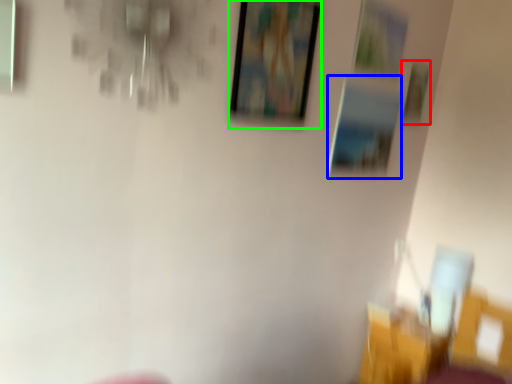
Question: Considering the real-world distances, which object is closest to picture frame (highlighted by a red box)? picture frame (highlighted by a blue box) or picture frame (highlighted by a green box).

Choices:
 (A) picture frame
 (B) picture frame

Answer: (A)